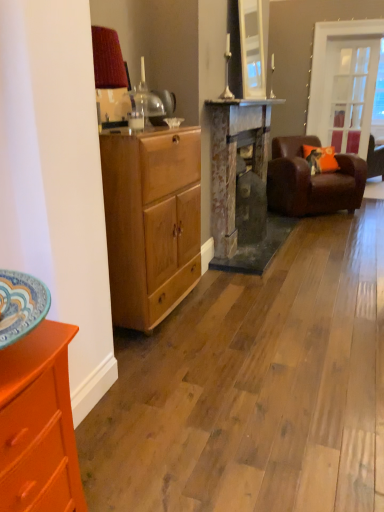
Question: From the image's perspective, would you say light brown wood cabinet at left is shown under brown leather couch at right?

Choices:
 (A) no
 (B) yes

Answer: (B)

Question: Considering the relative positions of light brown wood cabinet at left and brown leather couch at right in the image provided, is light brown wood cabinet at left behind brown leather couch at right?

Choices:
 (A) no
 (B) yes

Answer: (A)

Question: Considering the relative sizes of light brown wood cabinet at left and brown leather couch at right in the image provided, is light brown wood cabinet at left bigger than brown leather couch at right?

Choices:
 (A) no
 (B) yes

Answer: (A)

Question: Is light brown wood cabinet at left in contact with brown leather couch at right?

Choices:
 (A) no
 (B) yes

Answer: (A)

Question: Is light brown wood cabinet at left positioned beyond the bounds of brown leather couch at right?

Choices:
 (A) no
 (B) yes

Answer: (B)

Question: Is light brown wood cabinet at left shorter than brown leather couch at right?

Choices:
 (A) no
 (B) yes

Answer: (A)

Question: Does rusty metal fireplace at center have a lesser width compared to clear glass door at upper right?

Choices:
 (A) no
 (B) yes

Answer: (A)

Question: Is rusty metal fireplace at center beside clear glass door at upper right?

Choices:
 (A) yes
 (B) no

Answer: (B)

Question: Is clear glass door at upper right located within rusty metal fireplace at center?

Choices:
 (A) yes
 (B) no

Answer: (B)

Question: Are rusty metal fireplace at center and clear glass door at upper right located far from each other?

Choices:
 (A) yes
 (B) no

Answer: (A)

Question: Is rusty metal fireplace at center oriented away from clear glass door at upper right?

Choices:
 (A) yes
 (B) no

Answer: (B)

Question: Is rusty metal fireplace at center outside clear glass door at upper right?

Choices:
 (A) no
 (B) yes

Answer: (B)

Question: Considering the relative sizes of clear glass door at upper right and rusty metal fireplace at center in the image provided, is clear glass door at upper right thinner than rusty metal fireplace at center?

Choices:
 (A) no
 (B) yes

Answer: (B)